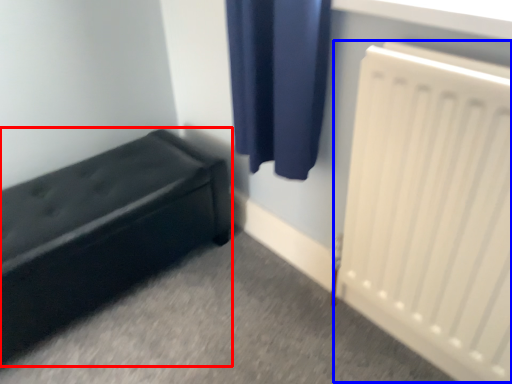
Question: Which of the following is the farthest to the observer, furniture (highlighted by a red box) or radiator (highlighted by a blue box)?

Choices:
 (A) furniture
 (B) radiator

Answer: (A)